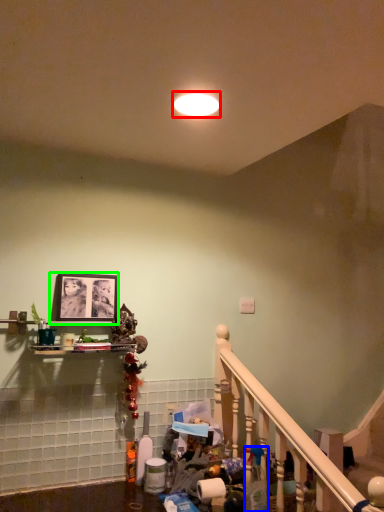
Question: Which object is positioned farthest from lighting (highlighted by a red box)? Select from cleaning product (highlighted by a blue box) and picture frame (highlighted by a green box).

Choices:
 (A) cleaning product
 (B) picture frame

Answer: (A)